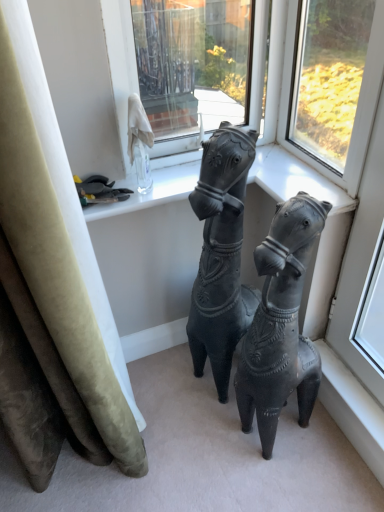
Find the location of a particular element. This screenshot has width=384, height=512. vacant space to the left of matte black horse at center is located at coordinates (207, 440).